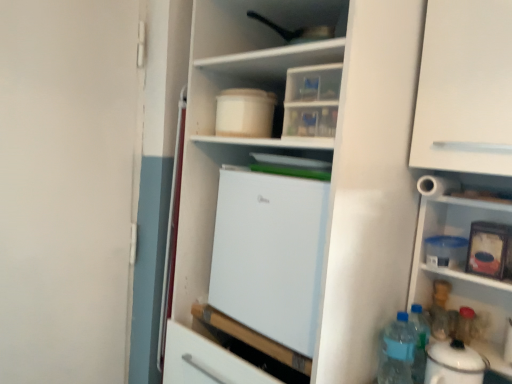
What do you see at coordinates (397, 351) in the screenshot? Image resolution: width=512 pixels, height=384 pixels. I see `translucent plastic bottles at lower right, positioned as the 3th bottle in back-to-front order` at bounding box center [397, 351].

This screenshot has height=384, width=512. Describe the element at coordinates (270, 254) in the screenshot. I see `white matte refrigerator at center` at that location.

Where is `white matte screen door at left`? The height and width of the screenshot is (384, 512). white matte screen door at left is located at coordinates (66, 188).

Identify the location of translucent plastic bottle at lower right, marked as the 2th bottle in a back-to-front arrangement. The width and height of the screenshot is (512, 384). (466, 325).

The image size is (512, 384). Identify the location of white matte cabinet at upper right. [x=465, y=88].

This screenshot has height=384, width=512. Identify the location of white glossy electric kettle at lower right. (453, 364).

Considering the sizes of objects white matte screen door at left and translucent plastic bottles at lower right, which ranks as the 3th bottle in right-to-left order, in the image provided, who is bigger, white matte screen door at left or translucent plastic bottles at lower right, which ranks as the 3th bottle in right-to-left order,?

white matte screen door at left.

Is white matte screen door at left positioned far away from translucent plastic bottles at lower right, which ranks as the 3th bottle in right-to-left order?

That's right, there is a large distance between white matte screen door at left and translucent plastic bottles at lower right, which ranks as the 3th bottle in right-to-left order.

Which is less distant, (x=54, y=26) or (x=406, y=344)?

The point (x=406, y=344) is closer.

What's the angular difference between white matte screen door at left and translucent plastic bottles at lower right, the 1th bottle when ordered from front to back,'s facing directions?

91.1 degrees.

Can you confirm if translucent plastic bottle at lower right, positioned as the first bottle in right-to-left order, is thinner than white matte refrigerator at center?

Yes.

Is point (468, 324) closer to viewer compared to point (246, 254)?

Yes, it is in front of point (246, 254).

Is translucent plastic bottle at lower right, which is the second bottle in front-to-back order, smaller than white matte refrigerator at center?

Indeed, translucent plastic bottle at lower right, which is the second bottle in front-to-back order, has a smaller size compared to white matte refrigerator at center.

From the picture: Could you tell me if white matte screen door at left is turned towards blue plastic bottle at lower right, the second bottle when ordered from left to right?

No, white matte screen door at left is not facing towards blue plastic bottle at lower right, the second bottle when ordered from left to right.

Is white matte screen door at left not inside blue plastic bottle at lower right, the first bottle viewed from the back?

Indeed, white matte screen door at left is completely outside blue plastic bottle at lower right, the first bottle viewed from the back.

From the image's perspective, would you say white matte screen door at left is positioned over blue plastic bottle at lower right, which is the 2th bottle from right to left?

Correct, white matte screen door at left appears higher than blue plastic bottle at lower right, which is the 2th bottle from right to left, in the image.

Which is less distant, (89,251) or (453,313)?

The point (453,313) is more forward.

Between blue plastic bottle at lower right, the second bottle when ordered from left to right, and translucent plastic bottles at lower right, the 1th bottle when ordered from front to back, which one is positioned behind?

Positioned behind is blue plastic bottle at lower right, the second bottle when ordered from left to right.

Are blue plastic bottle at lower right, the second bottle when ordered from left to right, and translucent plastic bottles at lower right, which ranks as the 3th bottle in right-to-left order, beside each other?

No, blue plastic bottle at lower right, the second bottle when ordered from left to right, is not touching translucent plastic bottles at lower right, which ranks as the 3th bottle in right-to-left order.

Is blue plastic bottle at lower right, positioned as the third bottle in front-to-back order, aimed at translucent plastic bottles at lower right, the 1th bottle when ordered from front to back?

Yes, blue plastic bottle at lower right, positioned as the third bottle in front-to-back order, is facing translucent plastic bottles at lower right, the 1th bottle when ordered from front to back.

Find the location of a particular element. Image resolution: width=512 pixels, height=384 pixels. the 1st bottle to the right of the translucent plastic bottles at lower right, the first bottle viewed from the left, starting your count from the anchor is located at coordinates (442, 312).

Does white matte refrigerator at center appear on the right side of translucent plastic bottles at lower right, the 1th bottle when ordered from front to back?

Incorrect, white matte refrigerator at center is not on the right side of translucent plastic bottles at lower right, the 1th bottle when ordered from front to back.

Considering the positions of points (275, 219) and (404, 325), is point (275, 219) farther from camera compared to point (404, 325)?

That is False.

Does white matte refrigerator at center have a larger size compared to translucent plastic bottles at lower right, the 1th bottle when ordered from front to back?

Yes, white matte refrigerator at center is bigger than translucent plastic bottles at lower right, the 1th bottle when ordered from front to back.

From a real-world perspective, which object stands above the other?

In real-world perspective, white matte refrigerator at center is above.

Which is in front, translucent plastic bottles at lower right, which ranks as the 3th bottle in right-to-left order, or white matte refrigerator at center?

white matte refrigerator at center.

Where is `the 1st bottle to the right of the white matte refrigerator at center, counting from the anchor's position`? The height and width of the screenshot is (384, 512). the 1st bottle to the right of the white matte refrigerator at center, counting from the anchor's position is located at coordinates (397, 351).

Is translucent plastic bottles at lower right, the 1th bottle when ordered from front to back, not near white matte refrigerator at center?

translucent plastic bottles at lower right, the 1th bottle when ordered from front to back, is actually quite close to white matte refrigerator at center.

Between point (117, 301) and point (424, 61), which one is positioned in front?

Positioned in front is point (424, 61).

Is white matte screen door at left not inside white matte cabinet at upper right?

white matte screen door at left lies outside white matte cabinet at upper right's area.

Is white matte screen door at left positioned far away from white matte cabinet at upper right?

Absolutely, white matte screen door at left is distant from white matte cabinet at upper right.

The height and width of the screenshot is (384, 512). I want to click on cabinetry above the white matte screen door at left (from the image's perspective), so click(x=465, y=88).

Locate an element on the screen. The width and height of the screenshot is (512, 384). screen door above the translucent plastic bottles at lower right, the 1th bottle when ordered from front to back (from the image's perspective) is located at coordinates (66, 188).

Locate an element on the screen. refrigerator lying on the left of translucent plastic bottle at lower right, marked as the 2th bottle in a back-to-front arrangement is located at coordinates (270, 254).

Considering their positions, is white matte refrigerator at center positioned closer to translucent plastic bottle at lower right, which is the second bottle in front-to-back order, than white matte cabinet at upper right?

white matte refrigerator at center is positioned closer to the anchor translucent plastic bottle at lower right, which is the second bottle in front-to-back order.

When comparing their distances from translucent plastic bottles at lower right, positioned as the 3th bottle in back-to-front order, does white matte refrigerator at center or white matte screen door at left seem further?

white matte screen door at left is further to translucent plastic bottles at lower right, positioned as the 3th bottle in back-to-front order.

From the picture: Considering their positions, is blue plastic bottle at lower right, the first bottle viewed from the back, positioned further to white glossy electric kettle at lower right than translucent plastic bottles at lower right, the first bottle viewed from the left?

The object further to white glossy electric kettle at lower right is blue plastic bottle at lower right, the first bottle viewed from the back.

Which object lies nearer to the anchor point white glossy electric kettle at lower right, white matte cabinet at upper right or blue plastic bottle at lower right, the first bottle viewed from the back?

Based on the image, blue plastic bottle at lower right, the first bottle viewed from the back, appears to be nearer to white glossy electric kettle at lower right.

Looking at the image, which one is located further to white matte refrigerator at center, white matte screen door at left or blue plastic bottle at lower right, positioned as the third bottle in front-to-back order?

The object further to white matte refrigerator at center is blue plastic bottle at lower right, positioned as the third bottle in front-to-back order.

Which object lies nearer to the anchor point blue plastic bottle at lower right, which is the 2th bottle from right to left, translucent plastic bottles at lower right, positioned as the 3th bottle in back-to-front order, or translucent plastic bottle at lower right, marked as the 2th bottle in a back-to-front arrangement?

translucent plastic bottle at lower right, marked as the 2th bottle in a back-to-front arrangement, is closer to blue plastic bottle at lower right, which is the 2th bottle from right to left.

Considering their positions, is translucent plastic bottle at lower right, positioned as the first bottle in right-to-left order, positioned further to translucent plastic bottles at lower right, positioned as the 3th bottle in back-to-front order, than white glossy electric kettle at lower right?

translucent plastic bottle at lower right, positioned as the first bottle in right-to-left order.

Which object lies nearer to the anchor point blue plastic bottle at lower right, the second bottle when ordered from left to right, white matte cabinet at upper right or translucent plastic bottles at lower right, the 1th bottle when ordered from front to back?

The object closer to blue plastic bottle at lower right, the second bottle when ordered from left to right, is translucent plastic bottles at lower right, the 1th bottle when ordered from front to back.

This screenshot has width=512, height=384. I want to click on refrigerator between white matte cabinet at upper right and white glossy electric kettle at lower right in the vertical direction, so click(x=270, y=254).

Identify the location of bottle between translucent plastic bottles at lower right, which ranks as the 3th bottle in right-to-left order, and translucent plastic bottle at lower right, marked as the 2th bottle in a back-to-front arrangement. This screenshot has width=512, height=384. (442, 312).

At what (x,y) coordinates should I click in order to perform the action: click on bottle between white matte screen door at left and white glossy electric kettle at lower right. Please return your answer as a coordinate pair (x, y). The height and width of the screenshot is (384, 512). Looking at the image, I should click on click(397, 351).

This screenshot has height=384, width=512. Find the location of `appliance between white matte screen door at left and blue plastic bottle at lower right, positioned as the third bottle in front-to-back order, from left to right`. appliance between white matte screen door at left and blue plastic bottle at lower right, positioned as the third bottle in front-to-back order, from left to right is located at coordinates (453, 364).